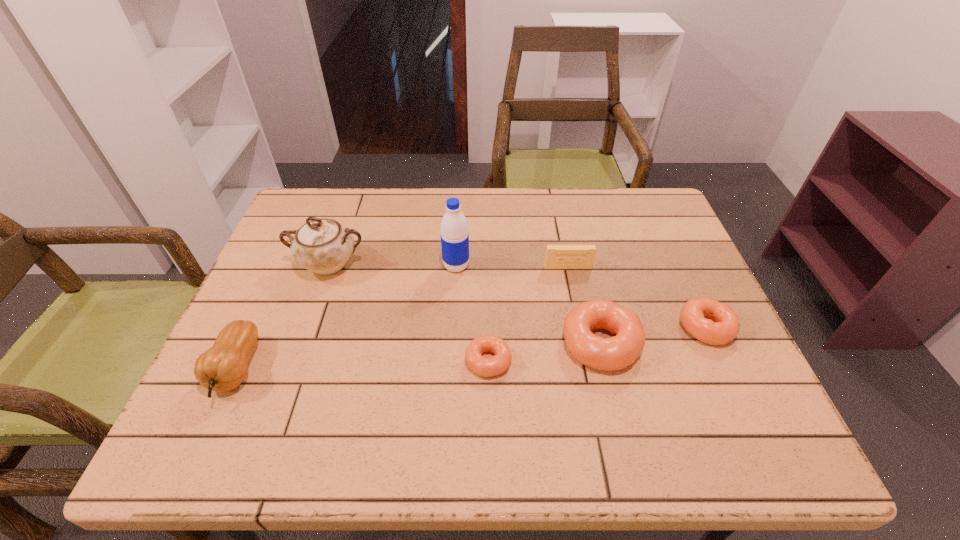
The width and height of the screenshot is (960, 540). I want to click on free spot located on the right of the tallest doughnut, so click(x=680, y=343).

You are a GUI agent. You are given a task and a screenshot of the screen. Output one action in this format:
    pyautogui.click(x=<x>, y=<y>)
    Task: Click on the vacant space located 0.350m on the back of the second tallest doughnut
    
    Given the screenshot: What is the action you would take?
    pyautogui.click(x=656, y=219)

This screenshot has width=960, height=540. I want to click on free space located on the front of the tallest object, so point(453,330).

Identify the location of vacant position located 0.390m on the right of the chinaware. (514, 264).

Locate an element on the screen. The image size is (960, 540). vacant area situated 0.130m at the front of the videotape with spools is located at coordinates (576, 307).

Find the location of `gourd present at the near edge`. gourd present at the near edge is located at coordinates (223, 367).

The image size is (960, 540). What are the coordinates of `chinaware that is at the left edge` in the screenshot? It's located at (323, 246).

Find the location of a particular element. The height and width of the screenshot is (540, 960). gourd that is at the left edge is located at coordinates pyautogui.click(x=223, y=367).

The width and height of the screenshot is (960, 540). Identify the location of object located at the right edge. (723, 325).

This screenshot has height=540, width=960. What are the coordinates of `object positioned at the near left corner` in the screenshot? It's located at (223, 367).